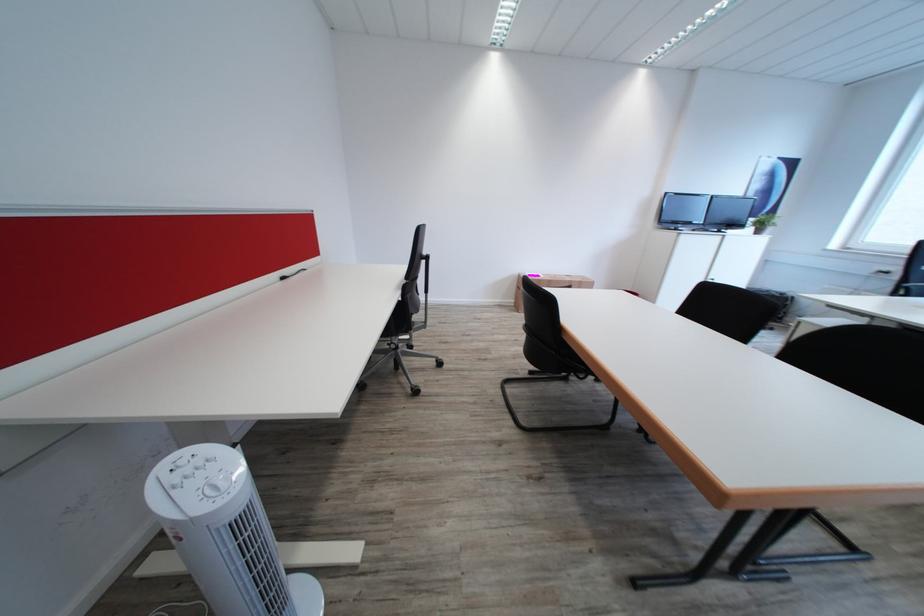
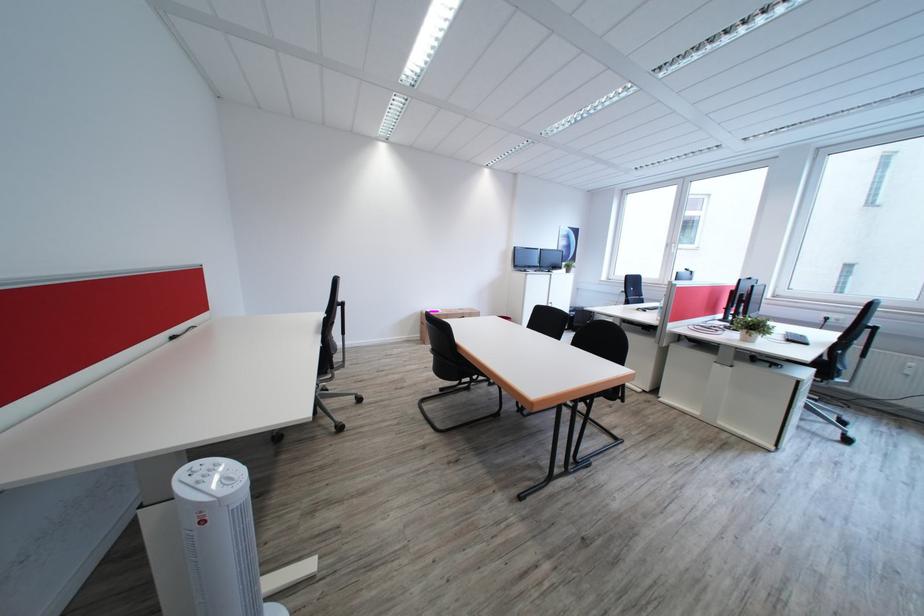
Find the pixel in the second image that matches (x=545, y=276) in the first image.

(445, 312)